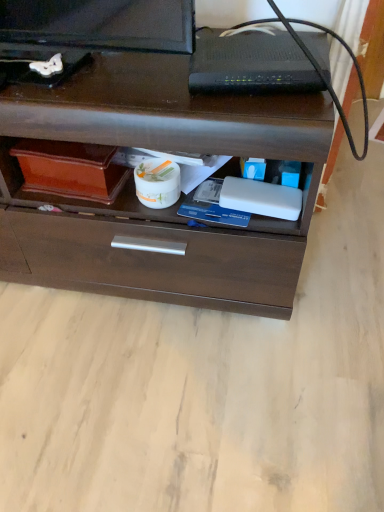
I want to click on free space on the front side of black plastic router at upper center, so click(x=258, y=114).